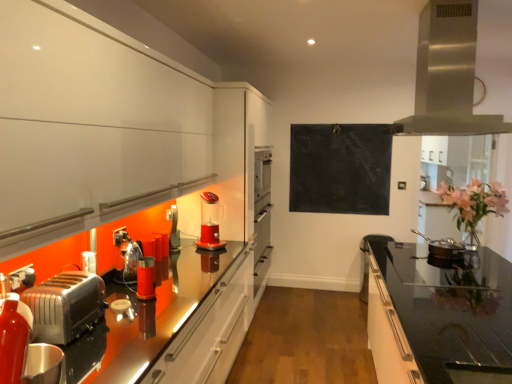
Identify the location of free space above black matte chalkboard at upper center (from a real-world perspective). point(338,127).